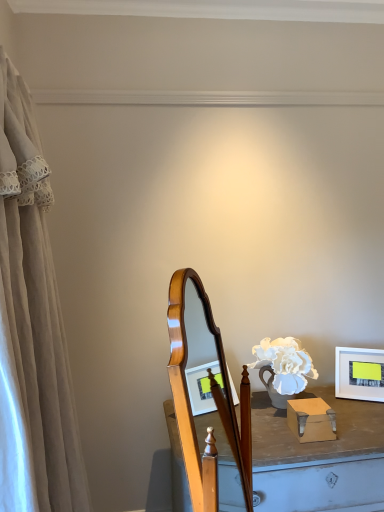
Question: Can you confirm if beige fabric curtain at left is positioned to the left of white matte picture frame at right?

Choices:
 (A) yes
 (B) no

Answer: (A)

Question: Is beige fabric curtain at left behind white matte picture frame at right?

Choices:
 (A) no
 (B) yes

Answer: (A)

Question: From the image's perspective, does beige fabric curtain at left appear higher than white matte picture frame at right?

Choices:
 (A) yes
 (B) no

Answer: (A)

Question: Is beige fabric curtain at left to the right of white matte picture frame at right from the viewer's perspective?

Choices:
 (A) no
 (B) yes

Answer: (A)

Question: From the image's perspective, is beige fabric curtain at left below white matte picture frame at right?

Choices:
 (A) yes
 (B) no

Answer: (B)

Question: Can you confirm if beige fabric curtain at left is taller than white matte picture frame at right?

Choices:
 (A) no
 (B) yes

Answer: (B)

Question: From a real-world perspective, is white matte picture frame at right located higher than beige fabric curtain at left?

Choices:
 (A) yes
 (B) no

Answer: (B)

Question: Does white matte picture frame at right have a greater height compared to beige fabric curtain at left?

Choices:
 (A) yes
 (B) no

Answer: (B)

Question: Does white matte picture frame at right have a greater width compared to beige fabric curtain at left?

Choices:
 (A) no
 (B) yes

Answer: (A)

Question: Considering the relative positions of white matte picture frame at right and beige fabric curtain at left in the image provided, is white matte picture frame at right to the left of beige fabric curtain at left from the viewer's perspective?

Choices:
 (A) yes
 (B) no

Answer: (B)

Question: Considering the relative sizes of white matte picture frame at right and beige fabric curtain at left in the image provided, is white matte picture frame at right shorter than beige fabric curtain at left?

Choices:
 (A) no
 (B) yes

Answer: (B)

Question: Does white matte picture frame at right have a larger size compared to beige fabric curtain at left?

Choices:
 (A) yes
 (B) no

Answer: (B)

Question: Considering the relative positions of white matte picture frame at right and beige fabric curtain at left in the image provided, is white matte picture frame at right to the left or to the right of beige fabric curtain at left?

Choices:
 (A) right
 (B) left

Answer: (A)